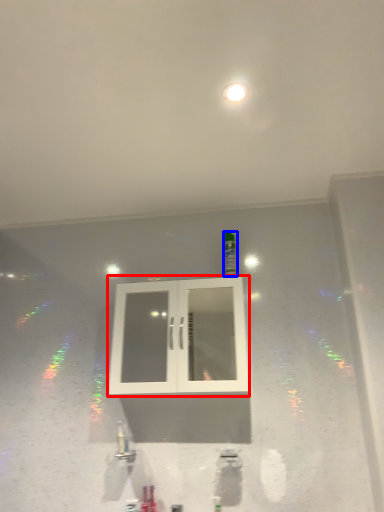
Question: Which point is closer to the camera, window (highlighted by a red box) or bottle (highlighted by a blue box)?

Choices:
 (A) window
 (B) bottle

Answer: (A)